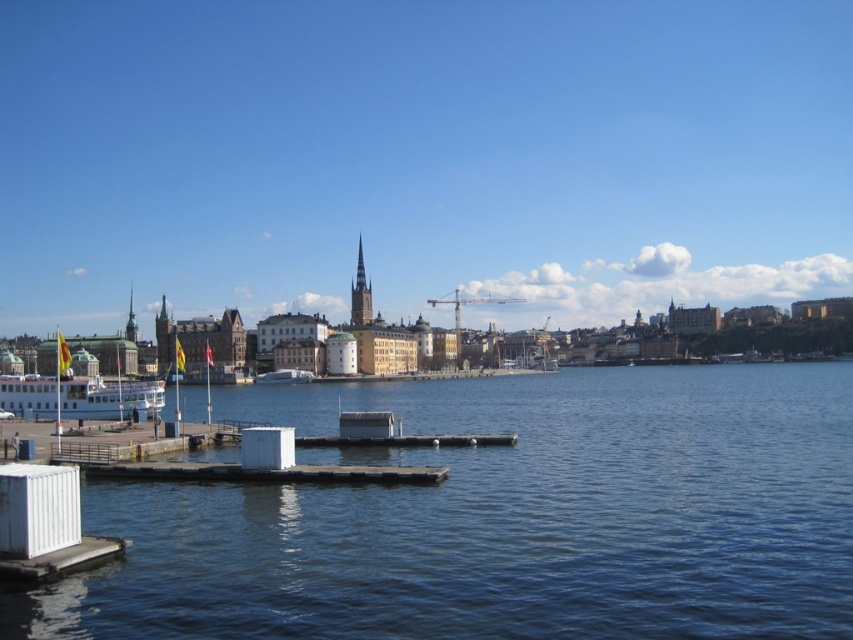
You are a tourist standing at the waterfront and want to take a photo that includes both the transparent water at lower left and the smooth stone spire at center. Since you need to frame them properly, which object should you position closer to the left side of your camera view?

You should position the smooth stone spire at center closer to the left side of your camera view because the transparent water at lower left is to the right of it.

You are standing on the dock and want to take a photo of the white glossy ferry at left without the transparent water at lower left blocking the view. Is this possible?

The transparent water at lower left is in front of the white glossy ferry at left, so it will block the view. Move to a position where the transparent water is not between you and the ferry.

Looking at this image, you are a photographer planning to capture the waterfront scene. You notice the transparent water at lower left and the white glossy ferry at left. Which of these two elements occupies a larger area in the image?

The white glossy ferry at left occupies a larger area in the image because the transparent water at lower left is smaller than it.